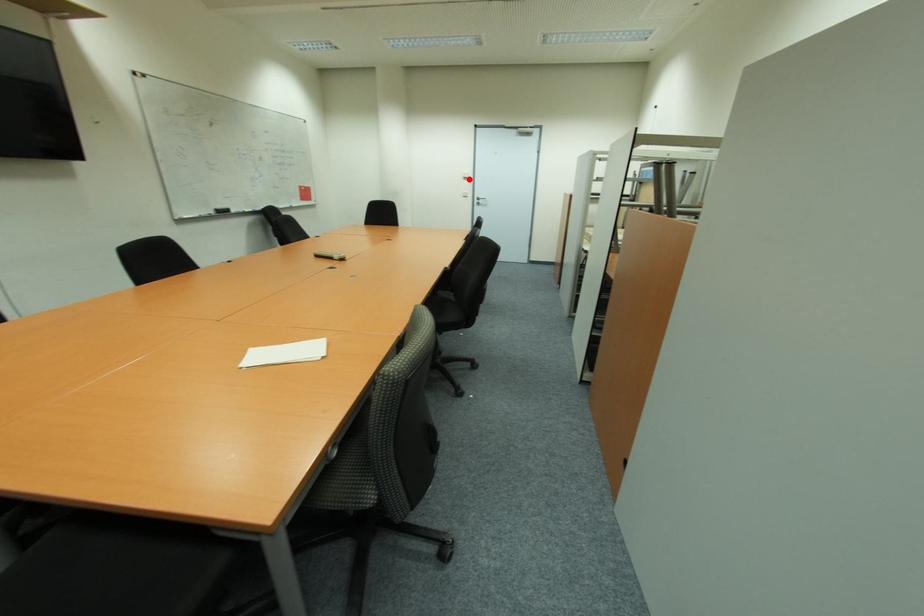
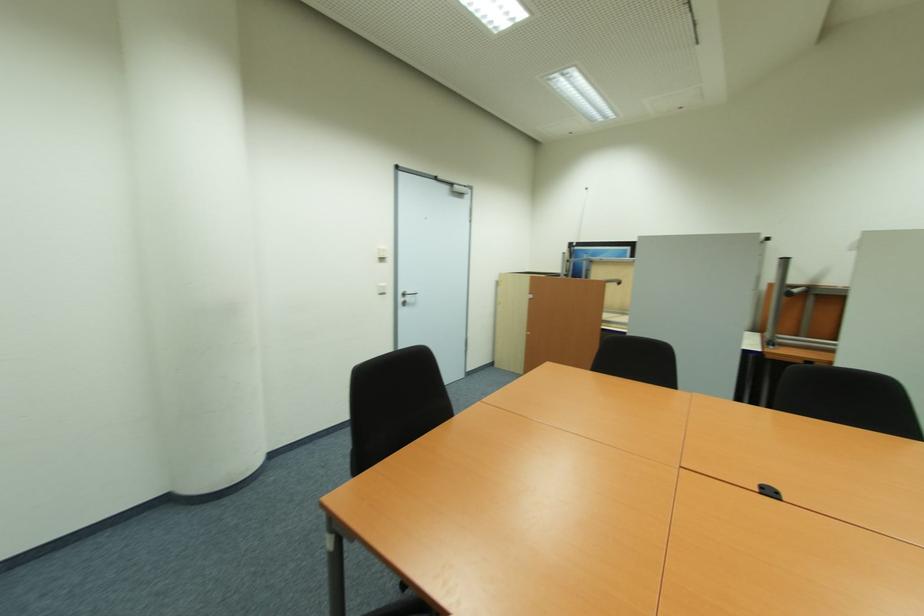
Find the pixel in the second image that matches the highlighted location in the first image.

(385, 260)